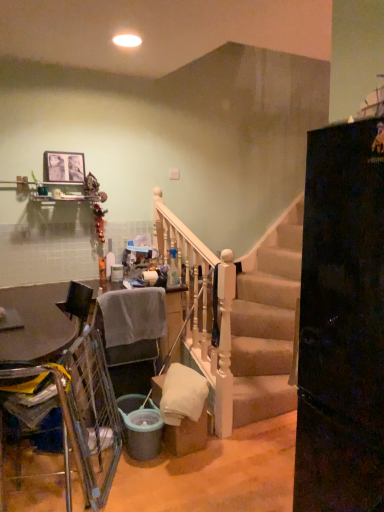
Question: Considering the relative sizes of metallic silver table at lower left and gray fabric chair at lower left, arranged as the 2th armchair when viewed from the front, in the image provided, is metallic silver table at lower left shorter than gray fabric chair at lower left, arranged as the 2th armchair when viewed from the front,?

Choices:
 (A) no
 (B) yes

Answer: (A)

Question: Is metallic silver table at lower left not close to gray fabric chair at lower left, which ranks as the first armchair in back-to-front order?

Choices:
 (A) yes
 (B) no

Answer: (B)

Question: Is metallic silver table at lower left touching gray fabric chair at lower left, arranged as the 2th armchair when viewed from the front?

Choices:
 (A) yes
 (B) no

Answer: (B)

Question: Considering the relative sizes of metallic silver table at lower left and gray fabric chair at lower left, which ranks as the first armchair in back-to-front order, in the image provided, is metallic silver table at lower left bigger than gray fabric chair at lower left, which ranks as the first armchair in back-to-front order,?

Choices:
 (A) yes
 (B) no

Answer: (A)

Question: Is metallic silver table at lower left closer to the viewer compared to gray fabric chair at lower left, arranged as the 2th armchair when viewed from the front?

Choices:
 (A) no
 (B) yes

Answer: (B)

Question: Is metallic silver table at lower left aimed at gray fabric chair at lower left, which ranks as the first armchair in back-to-front order?

Choices:
 (A) no
 (B) yes

Answer: (A)

Question: Considering the relative sizes of yellow fabric armchair at lower left, which ranks as the second armchair in back-to-front order, and metallic silver table at lower left in the image provided, is yellow fabric armchair at lower left, which ranks as the second armchair in back-to-front order, smaller than metallic silver table at lower left?

Choices:
 (A) no
 (B) yes

Answer: (B)

Question: From a real-world perspective, is yellow fabric armchair at lower left, which ranks as the second armchair in back-to-front order, below metallic silver table at lower left?

Choices:
 (A) no
 (B) yes

Answer: (A)

Question: Considering the relative sizes of yellow fabric armchair at lower left, which is the first armchair in front-to-back order, and metallic silver table at lower left in the image provided, is yellow fabric armchair at lower left, which is the first armchair in front-to-back order, thinner than metallic silver table at lower left?

Choices:
 (A) yes
 (B) no

Answer: (A)

Question: From the image's perspective, would you say yellow fabric armchair at lower left, which ranks as the second armchair in back-to-front order, is positioned over metallic silver table at lower left?

Choices:
 (A) yes
 (B) no

Answer: (A)

Question: Considering the relative sizes of yellow fabric armchair at lower left, which ranks as the second armchair in back-to-front order, and metallic silver table at lower left in the image provided, is yellow fabric armchair at lower left, which ranks as the second armchair in back-to-front order, bigger than metallic silver table at lower left?

Choices:
 (A) no
 (B) yes

Answer: (A)

Question: Could you tell me if yellow fabric armchair at lower left, which is the first armchair in front-to-back order, is facing metallic silver table at lower left?

Choices:
 (A) yes
 (B) no

Answer: (A)

Question: Is gray fabric chair at lower left, which ranks as the first armchair in back-to-front order, shorter than metallic silver table at lower left?

Choices:
 (A) no
 (B) yes

Answer: (B)